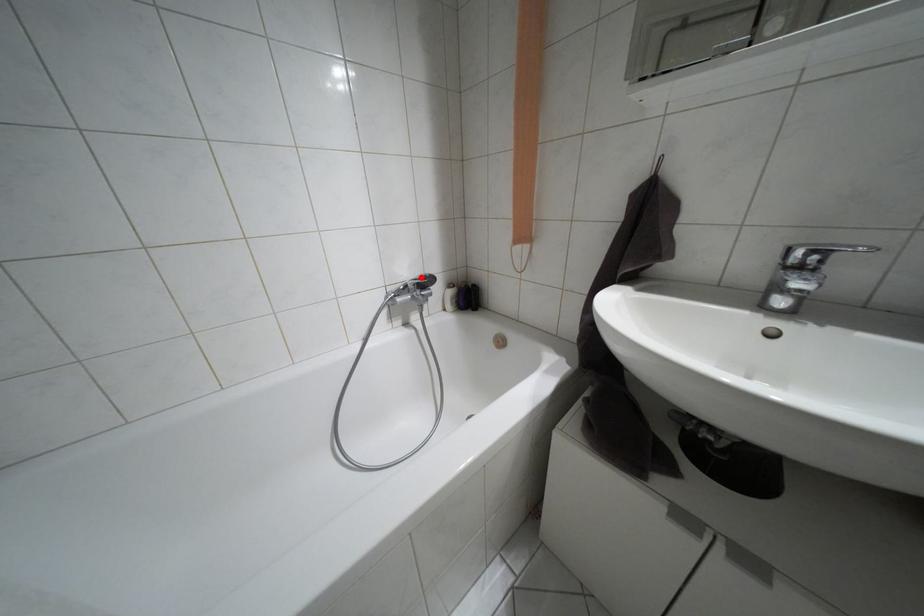
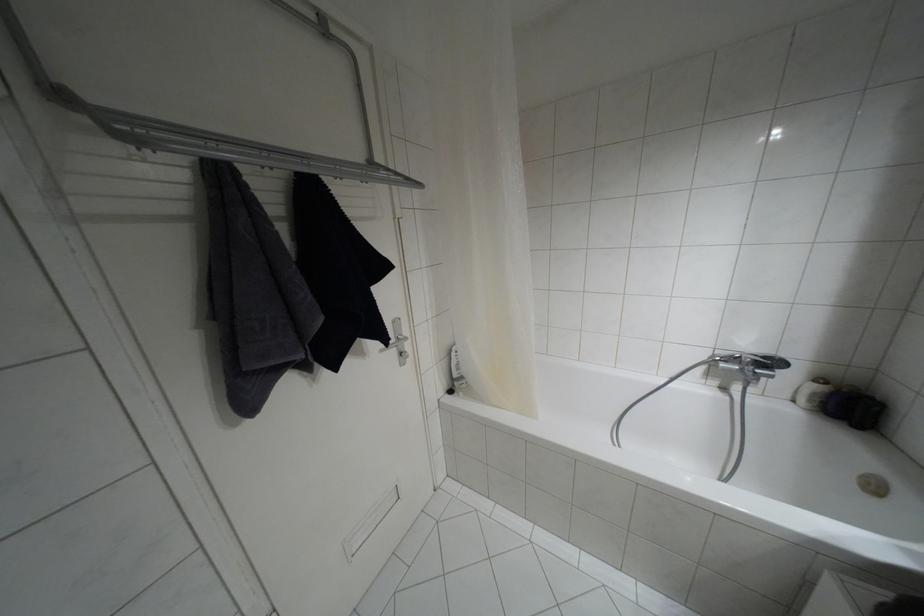
Question: I am providing you with two images of the same scene from different viewpoints. Given a red point in image1, look at the same physical point in image2. Is it:

Choices:
 (A) Closer to the viewpoint
 (B) Farther from the viewpoint

Answer: (B)